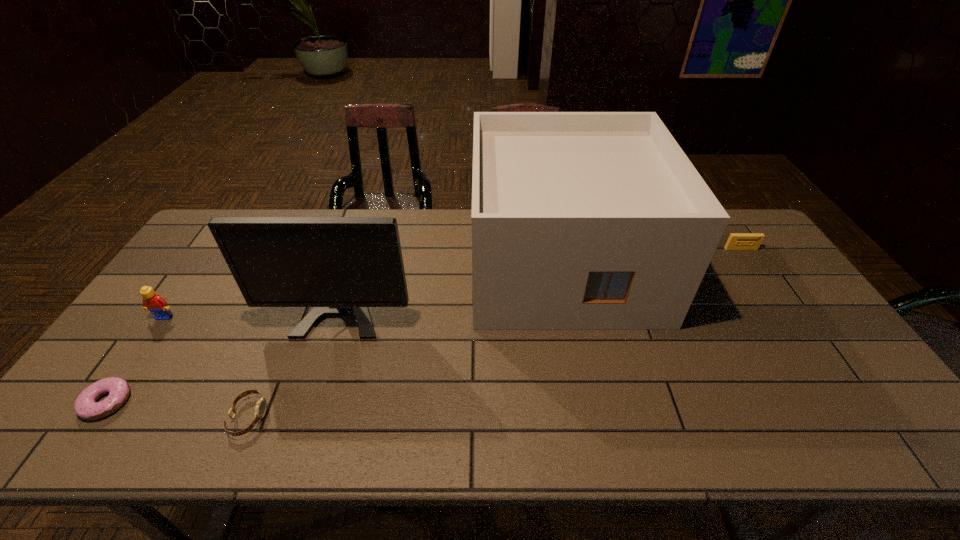
Find the location of `the second object from right to left`. the second object from right to left is located at coordinates (580, 220).

In order to click on computer monitor in this screenshot , I will do `click(340, 266)`.

Locate an element on the screen. This screenshot has width=960, height=540. the third tallest object is located at coordinates [155, 303].

Locate an element on the screen. This screenshot has width=960, height=540. videotape is located at coordinates (737, 241).

I want to click on the fourth tallest object, so click(x=737, y=241).

Identify the location of watch. Image resolution: width=960 pixels, height=540 pixels. (260, 409).

Locate an element on the screen. The width and height of the screenshot is (960, 540). the shortest object is located at coordinates (86, 406).

Find the location of a particular element. Image resolution: width=960 pixels, height=540 pixels. free spot located 0.300m on the side of the second object from right to left with the window is located at coordinates (598, 433).

Where is `vacant space located 0.140m on the screen side of the computer monitor`? This screenshot has width=960, height=540. vacant space located 0.140m on the screen side of the computer monitor is located at coordinates (319, 384).

The width and height of the screenshot is (960, 540). In order to click on vacant space located 0.250m on the front-facing side of the third tallest object in this screenshot , I will do `click(107, 400)`.